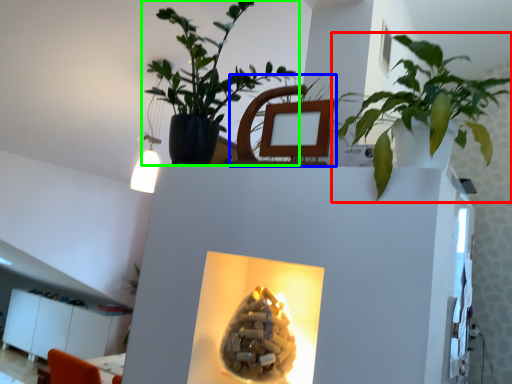
Question: Which is farther away from houseplant (highlighted by a red box)? swivel chair (highlighted by a blue box) or houseplant (highlighted by a green box)?

Choices:
 (A) swivel chair
 (B) houseplant

Answer: (B)